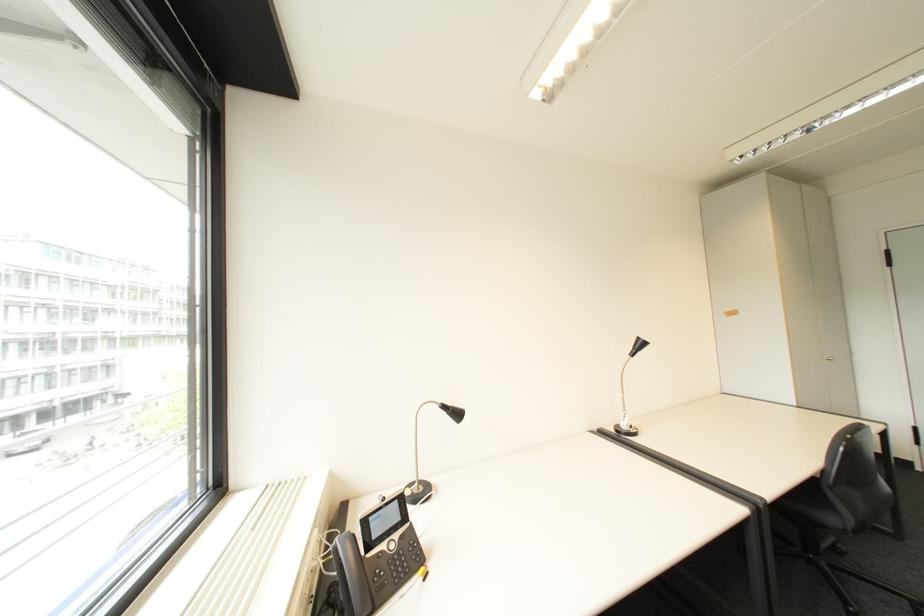
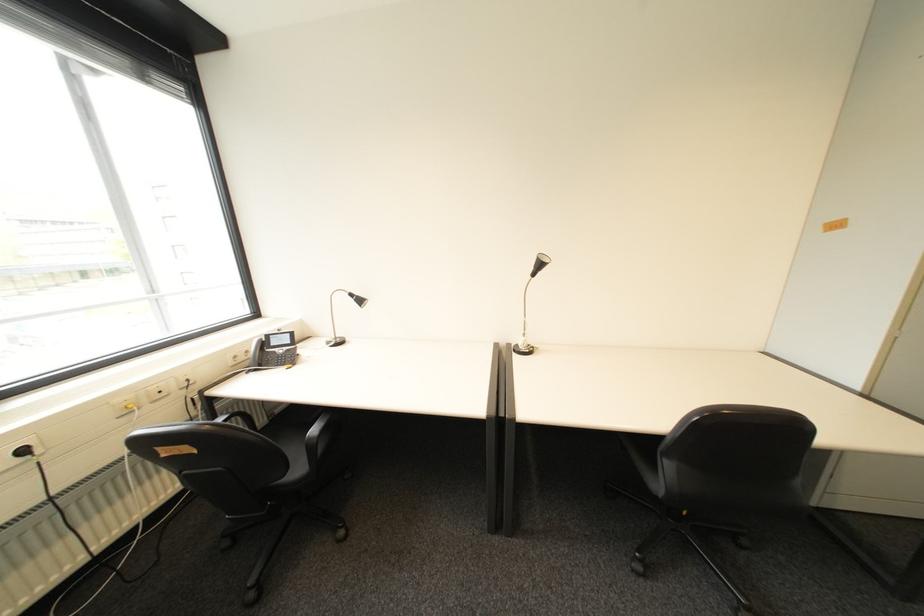
The point at (455, 415) is marked in the first image. Where is the corresponding point in the second image?

(362, 301)